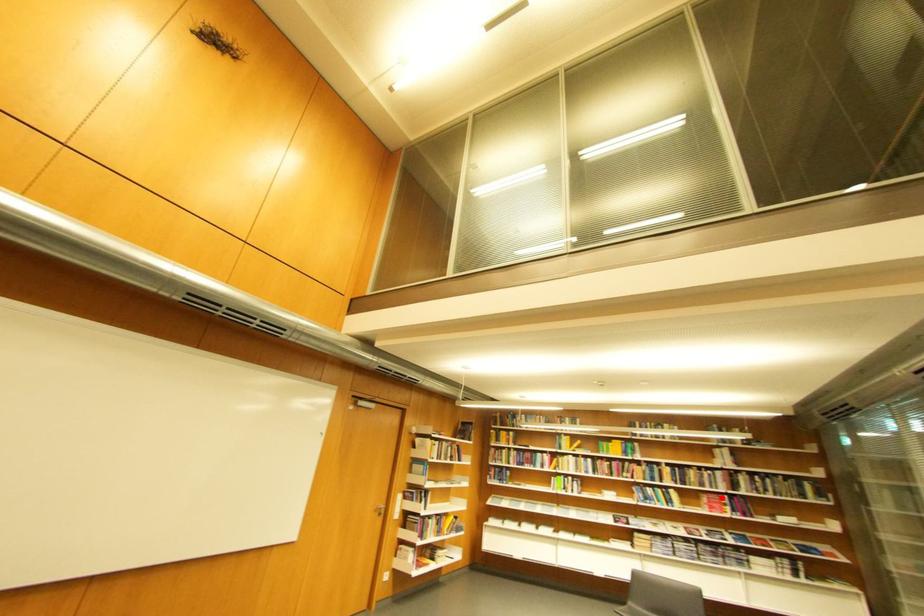
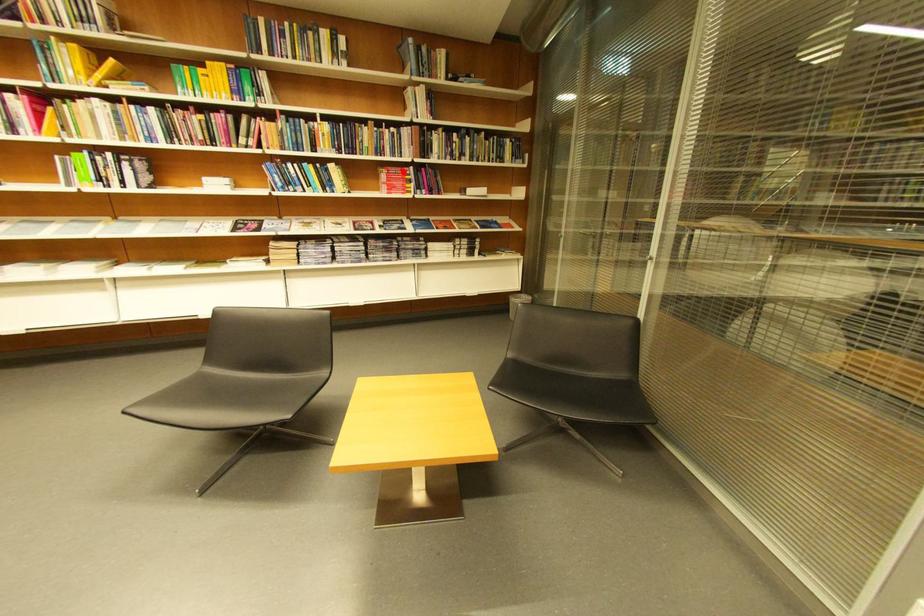
I am providing you with two images of the same scene from different viewpoints. A red point is marked on the first image and another point is marked on the second image. Do the highlighted points in image1 and image2 indicate the same real-world spot?

Yes